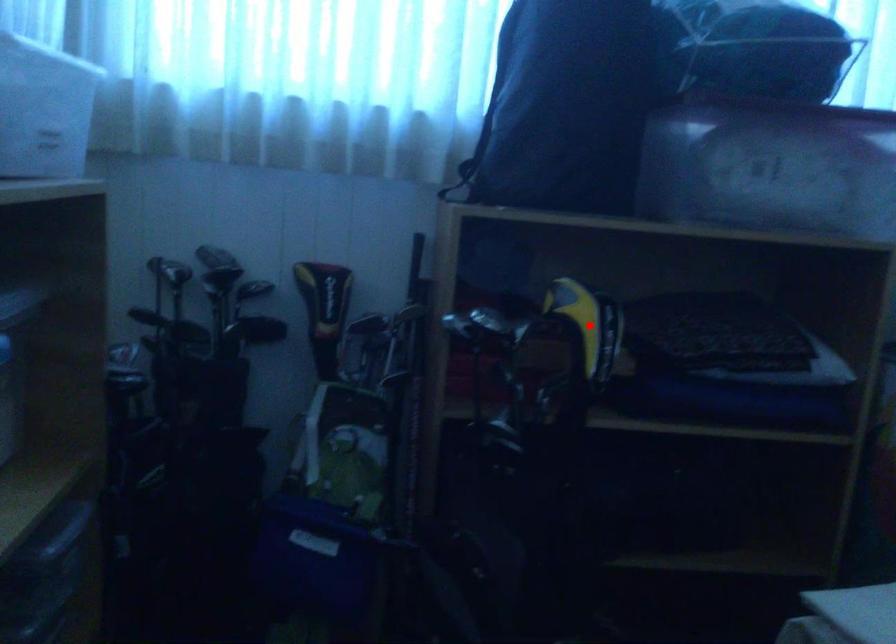
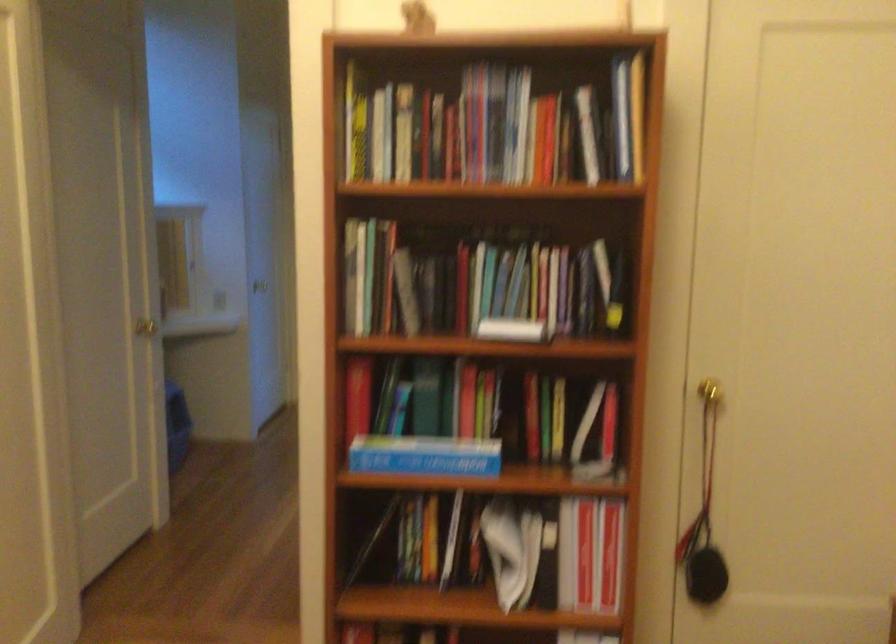
Question: I am providing you with two images of the same scene from different viewpoints. A red point is marked on the first image. Can you still see the location of the red point in image 2?

Choices:
 (A) Yes
 (B) No

Answer: (B)